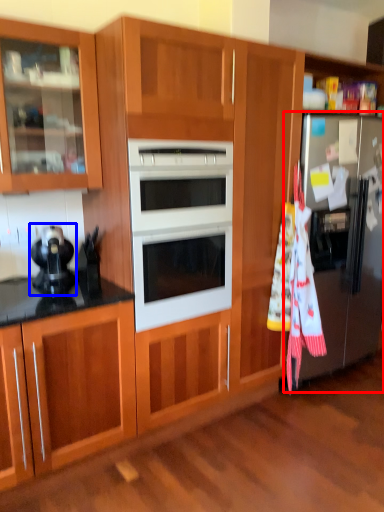
Question: Among these objects, which one is farthest to the camera, refrigerator (highlighted by a red box) or appliance (highlighted by a blue box)?

Choices:
 (A) refrigerator
 (B) appliance

Answer: (A)